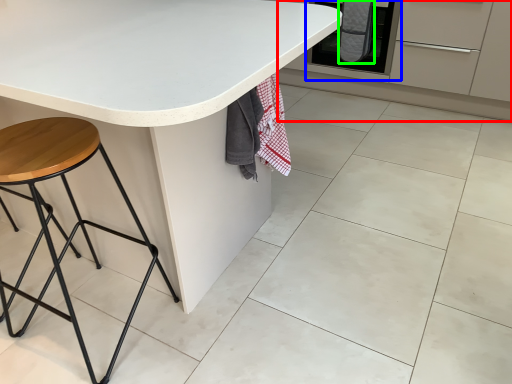
Question: Considering the real-world distances, which object is closest to cabinetry (highlighted by a red box)? oven (highlighted by a blue box) or blanket (highlighted by a green box).

Choices:
 (A) oven
 (B) blanket

Answer: (A)